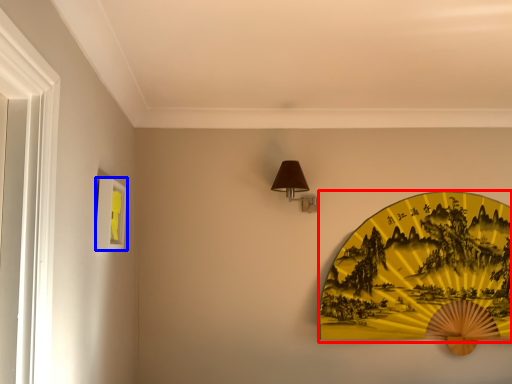
Question: Which object appears farthest to the camera in this image, design (highlighted by a red box) or picture frame (highlighted by a blue box)?

Choices:
 (A) design
 (B) picture frame

Answer: (A)